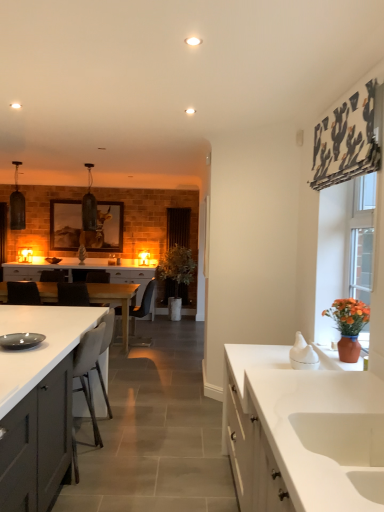
Find the location of `gray fabric chair at center, which is the first chair from right to left`. gray fabric chair at center, which is the first chair from right to left is located at coordinates (89, 370).

In order to face terracotta clay vase at right, should I rotate leftwards or rightwards?

You should look right and rotate roughly 19.946 degrees.

The image size is (384, 512). What are the coordinates of `matte gray cabinets at lower left, which appears as the first cabinetry when viewed from the front` in the screenshot? It's located at (38, 402).

What do you see at coordinates (133, 279) in the screenshot? The image size is (384, 512). I see `white glossy cabinet at center, arranged as the 2th cabinetry when viewed from the front` at bounding box center [133, 279].

Describe the element at coordinates (362, 237) in the screenshot. I see `clear glass door at right` at that location.

The width and height of the screenshot is (384, 512). I want to click on black leather chair at center, which is the first chair in back-to-front order, so click(x=97, y=277).

Image resolution: width=384 pixels, height=512 pixels. What do you see at coordinates (97, 277) in the screenshot?
I see `black leather chair at center, the second chair from the left` at bounding box center [97, 277].

Where is `gray fabric chair at center, positioned as the 4th chair in back-to-front order`? The image size is (384, 512). gray fabric chair at center, positioned as the 4th chair in back-to-front order is located at coordinates (89, 370).

Is white glossy cabinet at center, arranged as the 2th cabinetry when viewed from the front, at the right side of clear glass door at right?

No.

Is white glossy cabinet at center, the first cabinetry positioned from the back, thinner than clear glass door at right?

No, white glossy cabinet at center, the first cabinetry positioned from the back, is not thinner than clear glass door at right.

Measure the distance from white glossy cabinet at center, arranged as the 2th cabinetry when viewed from the front, to clear glass door at right.

white glossy cabinet at center, arranged as the 2th cabinetry when viewed from the front, and clear glass door at right are 4.59 meters apart from each other.

Which point is more forward, (133, 270) or (368, 240)?

The point (368, 240) is in front.

Which of these two, white glossy cabinet at center, the first cabinetry positioned from the back, or terracotta clay vase at right, stands shorter?

terracotta clay vase at right is shorter.

From the image's perspective, is white glossy cabinet at center, arranged as the 2th cabinetry when viewed from the front, located above or below terracotta clay vase at right?

Based on their image positions, white glossy cabinet at center, arranged as the 2th cabinetry when viewed from the front, is located beneath terracotta clay vase at right.

In the scene shown: What's the angular difference between white glossy cabinet at center, arranged as the 2th cabinetry when viewed from the front, and terracotta clay vase at right's facing directions?

white glossy cabinet at center, arranged as the 2th cabinetry when viewed from the front, and terracotta clay vase at right are facing 88.5 degrees away from each other.

From a real-world perspective, is white glossy cabinet at center, arranged as the 2th cabinetry when viewed from the front, on top of terracotta clay vase at right?

Actually, white glossy cabinet at center, arranged as the 2th cabinetry when viewed from the front, is physically below terracotta clay vase at right in the real world.

Is white glossy table at center in contact with black leather chair at center, the second chair from the left?

There is a gap between white glossy table at center and black leather chair at center, the second chair from the left.

I want to click on table beneath the black leather chair at center, which is the first chair in back-to-front order (from a real-world perspective), so click(x=115, y=301).

From the image's perspective, is white glossy table at center located above or below black leather chair at center, the 3th chair in the right-to-left sequence?

Clearly, from the image's perspective, white glossy table at center is below black leather chair at center, the 3th chair in the right-to-left sequence.

Can you confirm if white glossy table at center is positioned to the left of black leather chair at center, the 3th chair in the right-to-left sequence?

Correct, you'll find white glossy table at center to the left of black leather chair at center, the 3th chair in the right-to-left sequence.

There is a black leather chair at center, placed as the third chair when sorted from back to front. Where is `the 1st chair above it (from the image's perspective)`? This screenshot has height=512, width=384. the 1st chair above it (from the image's perspective) is located at coordinates (97, 277).

Looking at their sizes, would you say black leather chair at center, which ranks as the 2th chair in front-to-back order, is wider or thinner than black leather chair at center, the 3th chair in the right-to-left sequence?

In the image, black leather chair at center, which ranks as the 2th chair in front-to-back order, appears to be wider than black leather chair at center, the 3th chair in the right-to-left sequence.

Are black leather chair at center, marked as the 2th chair in a right-to-left arrangement, and black leather chair at center, the second chair from the left, making contact?

There is a gap between black leather chair at center, marked as the 2th chair in a right-to-left arrangement, and black leather chair at center, the second chair from the left.

Can you confirm if black leather chair at center, marked as the 2th chair in a right-to-left arrangement, is bigger than black leather chair at center, the 3th chair in the right-to-left sequence?

Correct, black leather chair at center, marked as the 2th chair in a right-to-left arrangement, is larger in size than black leather chair at center, the 3th chair in the right-to-left sequence.

Is white glossy sink at lower right beside matte gray cabinets at lower left, which appears as the first cabinetry when viewed from the front?

white glossy sink at lower right is not next to matte gray cabinets at lower left, which appears as the first cabinetry when viewed from the front, and they're not touching.

Which object is further away from the camera taking this photo, white glossy sink at lower right or matte gray cabinets at lower left, the second cabinetry positioned from the back?

Positioned behind is white glossy sink at lower right.

Is white glossy sink at lower right facing towards matte gray cabinets at lower left, the second cabinetry positioned from the back?

Yes, white glossy sink at lower right is aimed at matte gray cabinets at lower left, the second cabinetry positioned from the back.

From the image's perspective, which cabinetry is the 1st one above the white glossy sink at lower right? Please provide its 2D coordinates.

[(38, 402)]

Is point (62, 270) closer or farther from the camera than point (91, 286)?

Point (62, 270) is positioned farther from the camera compared to point (91, 286).

Is black leather chair at left, the third chair viewed from the front, facing towards white glossy table at center?

Yes, black leather chair at left, the third chair viewed from the front, faces towards white glossy table at center.

Is black leather chair at left, the second chair positioned from the back, next to white glossy table at center?

No, black leather chair at left, the second chair positioned from the back, is not beside white glossy table at center.

Is black leather chair at left, the third chair viewed from the front, wider than white glossy table at center?

In fact, black leather chair at left, the third chair viewed from the front, might be narrower than white glossy table at center.

Is point (2, 287) behind point (155, 285)?

No, it is in front of (155, 285).

Is white glossy table at center situated inside black leather chair at center, placed as the third chair when sorted from back to front, or outside?

white glossy table at center is spatially situated outside black leather chair at center, placed as the third chair when sorted from back to front.

Is white glossy table at center aimed at black leather chair at center, which ranks as the 2th chair in front-to-back order?

No, white glossy table at center does not turn towards black leather chair at center, which ranks as the 2th chair in front-to-back order.

Measure the distance between white glossy table at center and black leather chair at center, marked as the 2th chair in a right-to-left arrangement.

white glossy table at center is 1.22 meters away from black leather chair at center, marked as the 2th chair in a right-to-left arrangement.

Which cabinetry is the 1st one when counting from the left side of the clear glass door at right? Please provide its 2D coordinates.

[(133, 279)]

Find the location of a particular element. The width and height of the screenshot is (384, 512). houseplant on the right of white glossy cabinet at center, arranged as the 2th cabinetry when viewed from the front is located at coordinates (349, 326).

Estimate the real-world distances between objects in this image. Which object is further from gray fabric chair at center, which is the first chair from right to left, white glossy sink at lower right or white glossy cabinet at center, arranged as the 2th cabinetry when viewed from the front?

white glossy cabinet at center, arranged as the 2th cabinetry when viewed from the front.

Considering their positions, is matte gray cabinets at lower left, which appears as the first cabinetry when viewed from the front, positioned further to black leather chair at center, which ranks as the 2th chair in front-to-back order, than white glossy sink at lower right?

white glossy sink at lower right lies further to black leather chair at center, which ranks as the 2th chair in front-to-back order, than the other object.

Which object lies nearer to the anchor point black leather chair at center, marked as the 2th chair in a right-to-left arrangement, white glossy cabinet at center, arranged as the 2th cabinetry when viewed from the front, or matte gray cabinets at lower left, the second cabinetry positioned from the back?

Among the two, white glossy cabinet at center, arranged as the 2th cabinetry when viewed from the front, is located nearer to black leather chair at center, marked as the 2th chair in a right-to-left arrangement.

Estimate the real-world distances between objects in this image. Which object is closer to black leather chair at left, the 1th chair when ordered from left to right, clear glass door at right or white glossy sink at lower right?

Based on the image, clear glass door at right appears to be nearer to black leather chair at left, the 1th chair when ordered from left to right.

Which object lies nearer to the anchor point black leather chair at left, the 4th chair viewed from the right, black leather chair at center, marked as the 2th chair in a right-to-left arrangement, or white glossy sink at lower right?

The object closer to black leather chair at left, the 4th chair viewed from the right, is black leather chair at center, marked as the 2th chair in a right-to-left arrangement.

Looking at the image, which one is located closer to white glossy table at center, matte gray cabinets at lower left, which appears as the first cabinetry when viewed from the front, or black leather chair at center, positioned as the 3th chair in left-to-right order?

Among the two, black leather chair at center, positioned as the 3th chair in left-to-right order, is located nearer to white glossy table at center.

Based on their spatial positions, is matte gray cabinets at lower left, the second cabinetry positioned from the back, or white glossy sink at lower right closer to white glossy table at center?

Based on the image, matte gray cabinets at lower left, the second cabinetry positioned from the back, appears to be nearer to white glossy table at center.

Considering their positions, is gray fabric chair at center, positioned as the 4th chair in back-to-front order, positioned closer to white glossy cabinet at center, arranged as the 2th cabinetry when viewed from the front, than white glossy table at center?

white glossy table at center.

At what (x,y) coordinates should I click in order to perform the action: click on table between matte gray cabinets at lower left, which appears as the first cabinetry when viewed from the front, and black leather chair at left, the second chair positioned from the back, in the front-back direction. Please return your answer as a coordinate pair (x, y). The height and width of the screenshot is (512, 384). Looking at the image, I should click on (115, 301).

Find the location of a particular element. glass door between matte gray cabinets at lower left, the second cabinetry positioned from the back, and white glossy cabinet at center, the first cabinetry positioned from the back, in the front-back direction is located at coordinates (362, 237).

Where is `glass door between matte gray cabinets at lower left, the second cabinetry positioned from the back, and black leather chair at center, the second chair from the left, along the z-axis`? This screenshot has width=384, height=512. glass door between matte gray cabinets at lower left, the second cabinetry positioned from the back, and black leather chair at center, the second chair from the left, along the z-axis is located at coordinates (362, 237).

Image resolution: width=384 pixels, height=512 pixels. In order to click on chair positioned between clear glass door at right and black leather chair at center, positioned as the 3th chair in left-to-right order, from near to far in this screenshot , I will do `click(89, 370)`.